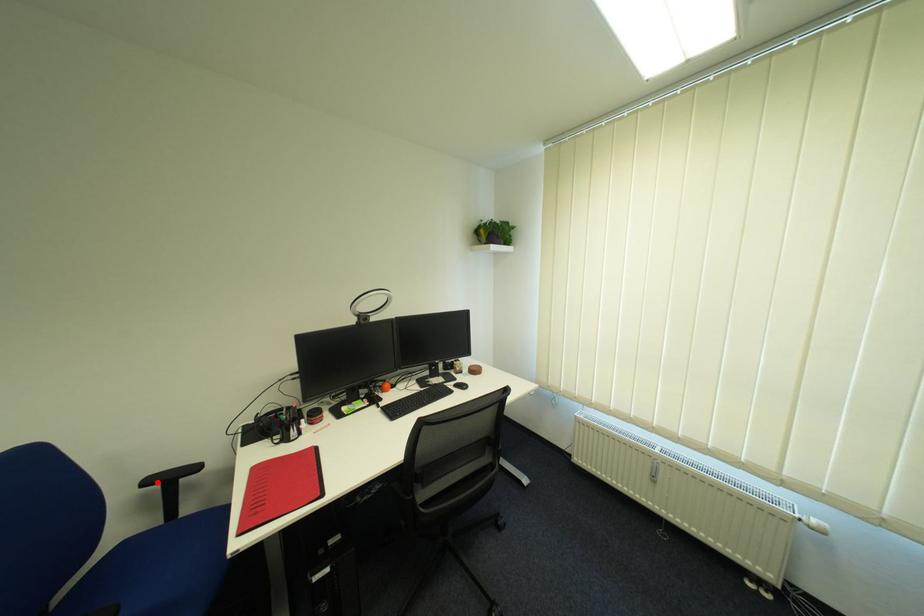
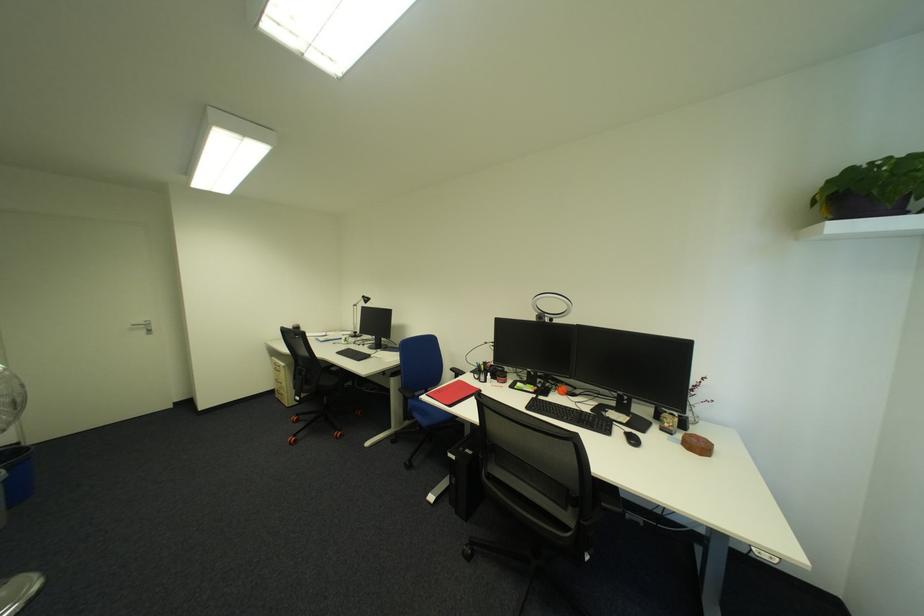
Question: I am providing you with two images of the same scene from different viewpoints. Given a red point in image1, look at the same physical point in image2. Is it:

Choices:
 (A) Closer to the viewpoint
 (B) Farther from the viewpoint

Answer: (B)